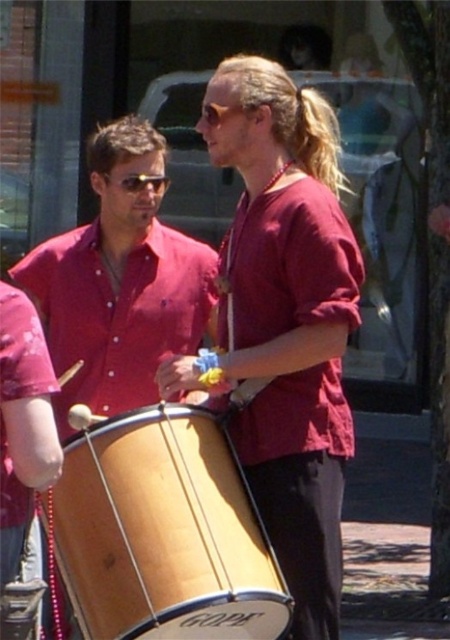
Question: Can you confirm if matte red shirt at center is positioned below sunglasses at left?

Choices:
 (A) no
 (B) yes

Answer: (B)

Question: Among these points, which one is farthest from the camera?

Choices:
 (A) (333, 486)
 (B) (58, 308)
 (C) (136, 173)
 (D) (241, 508)

Answer: (B)

Question: Does wooden drum at center appear under matte wood drum at center?

Choices:
 (A) no
 (B) yes

Answer: (B)

Question: Which point is closer to the camera?

Choices:
 (A) sunglasses at left
 (B) matte red shirt at center

Answer: (B)

Question: Does wooden drum at center appear under sunglasses at left?

Choices:
 (A) yes
 (B) no

Answer: (A)

Question: Among these points, which one is nearest to the camera?

Choices:
 (A) click(342, 342)
 (B) click(153, 296)
 (C) click(170, 630)
 (D) click(165, 177)

Answer: (C)